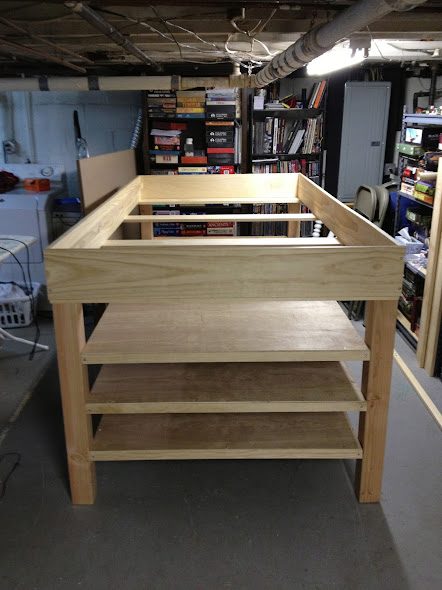
The width and height of the screenshot is (442, 590). Find the location of `shelf`. shelf is located at coordinates (418, 118).